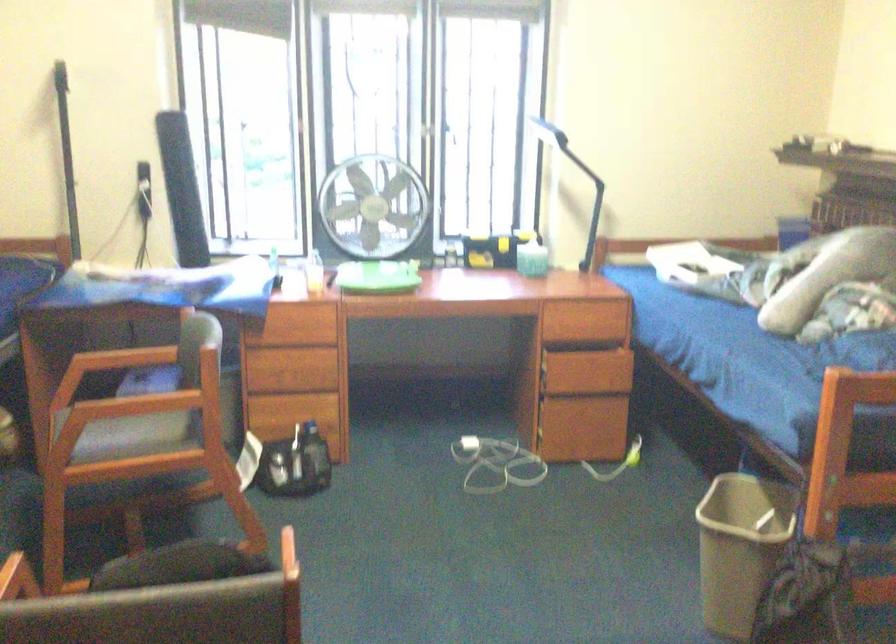
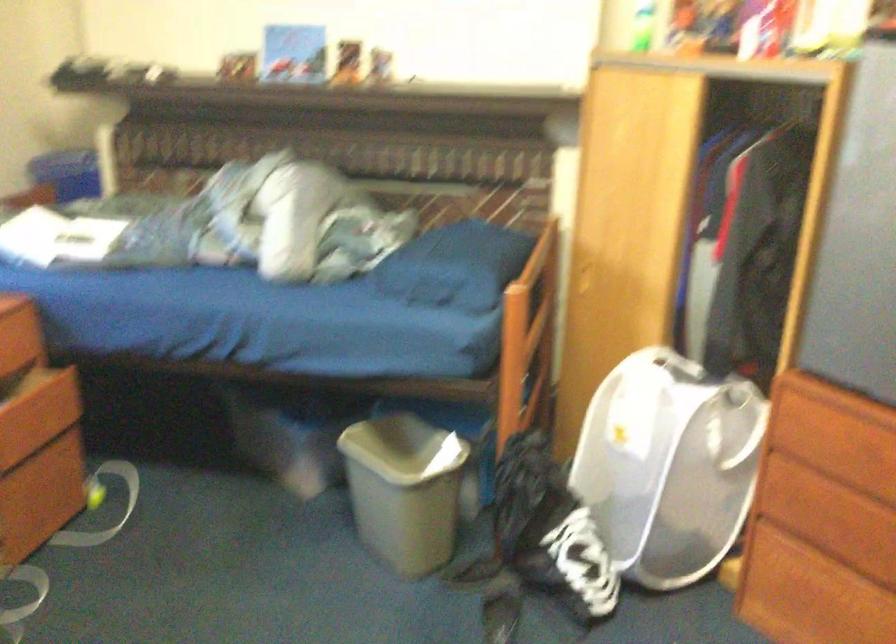
Find the pixel in the second image that matches (725,538) in the first image.

(403, 489)